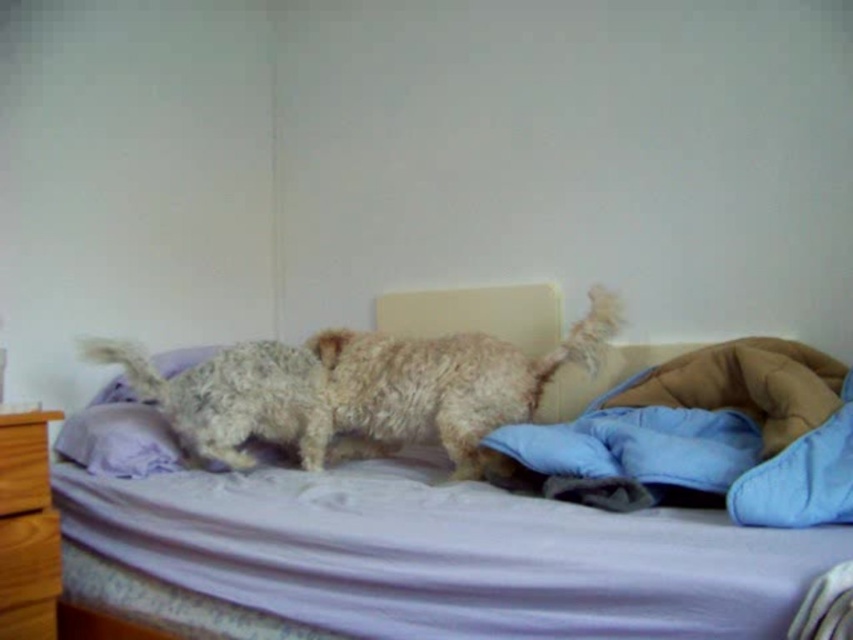
Question: Estimate the real-world distances between objects in this image. Which object is closer to the fuzzy beige dog at center?

Choices:
 (A) brown wooden dresser at lower left
 (B) purple fabric bed at center

Answer: (B)

Question: In this image, where is fuzzy fur dog at center located relative to fuzzy beige dog at center?

Choices:
 (A) left
 (B) right

Answer: (B)

Question: Is purple fabric bed at center smaller than fuzzy beige dog at center?

Choices:
 (A) no
 (B) yes

Answer: (A)

Question: Based on their relative distances, which object is nearer to the wooden drawer at left?

Choices:
 (A) fuzzy beige dog at center
 (B) purple fabric bed at center
 (C) fuzzy fur dog at center

Answer: (A)

Question: Which point is closer to the camera?

Choices:
 (A) wooden drawer at left
 (B) fuzzy fur dog at center

Answer: (A)

Question: Does brown wooden dresser at lower left appear under wooden drawer at left?

Choices:
 (A) no
 (B) yes

Answer: (B)